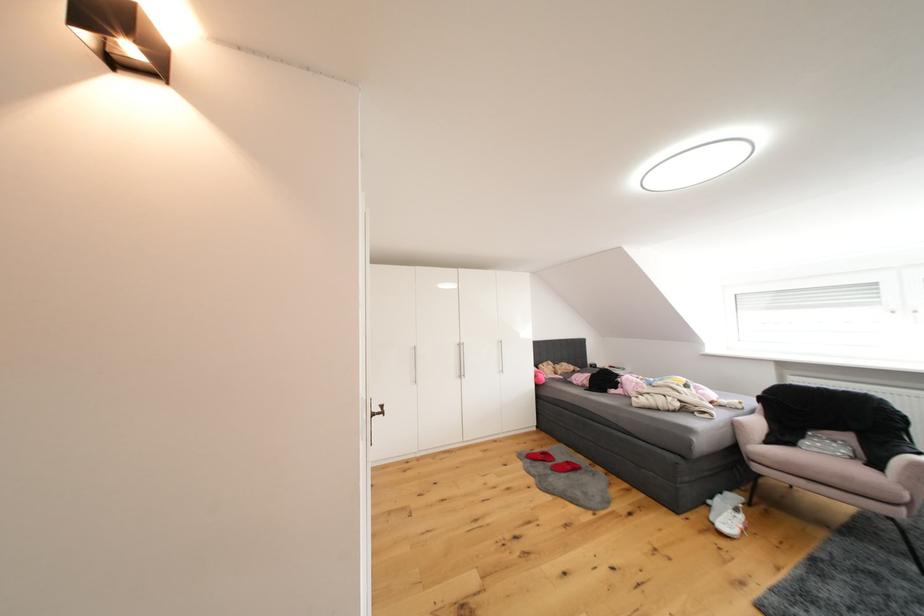
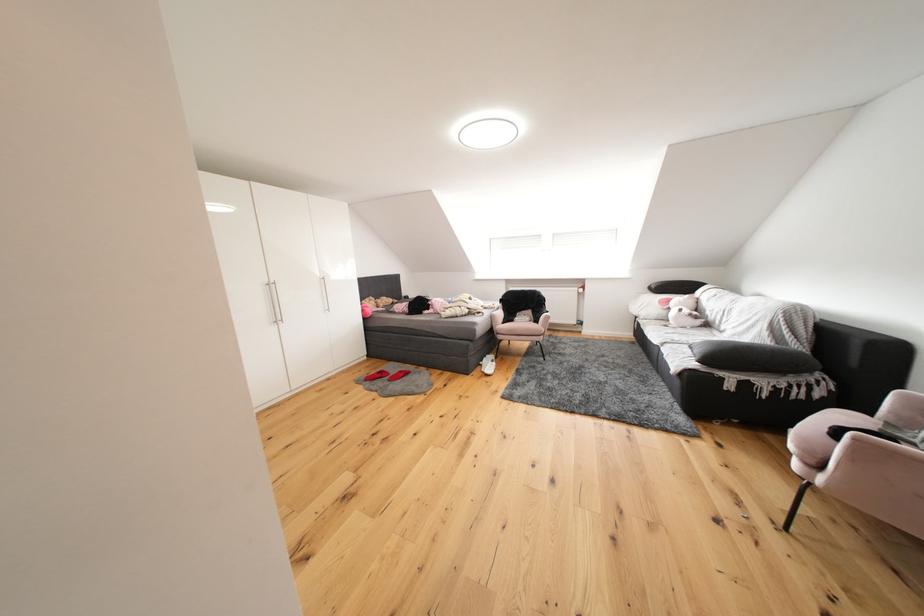
In the second image, find the point that corresponds to point 719,509 in the first image.

(490, 369)